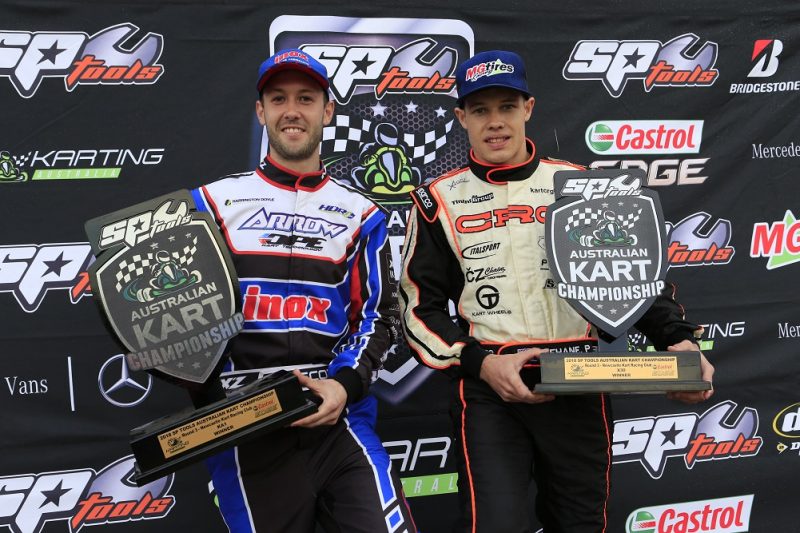
The image size is (800, 533). I want to click on trophy, so coord(166,290), coord(613,239).